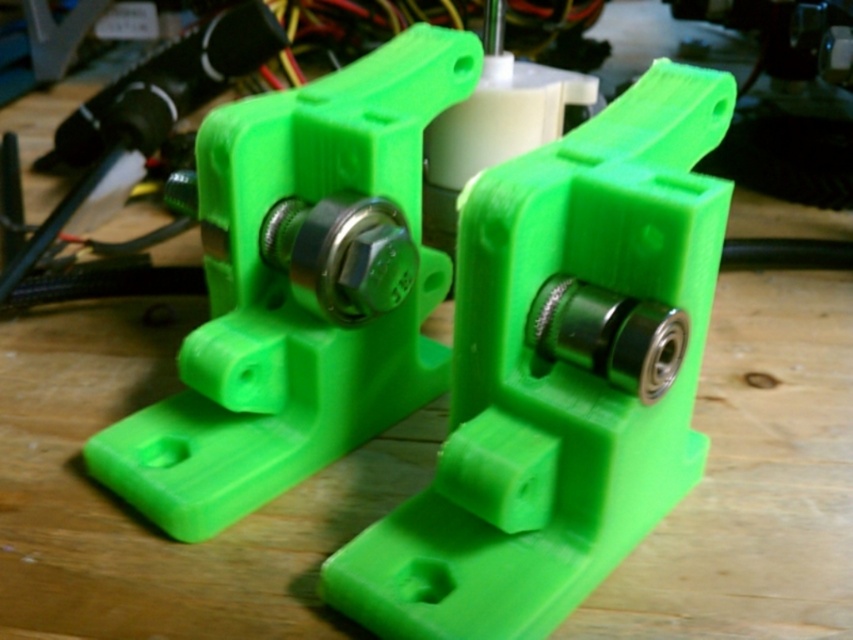
Based on the photo, you are working on assembling a robotic arm and need to place two green matte plastic parts on a workbench. The first part is labeled as the green matte plastic at center, and the second is the green matte plastic object at center. If the workbench has a space of 9 inches between two fixed brackets, will both parts fit side by side without overlapping?

The green matte plastic at center is 8.63 inches from green matte plastic object at center, so yes, both parts can fit side by side within the 9 inches space between the brackets since the total required space is less than 9 inches.

You are an engineer inspecting two green matte plastic parts on a workbench. You need to determine which part is thinner. You have the green matte plastic at center and the green matte plastic object at center in front of you. Which one is thinner?

The green matte plastic at center is thinner than the green matte plastic object at center.

You are an engineer inspecting two green matte plastic components on a workbench. You need to determine which one is shorter between the green matte plastic at center and the green matte plastic object at center. Which one is shorter?

The green matte plastic at center is shorter than the green matte plastic object at center.